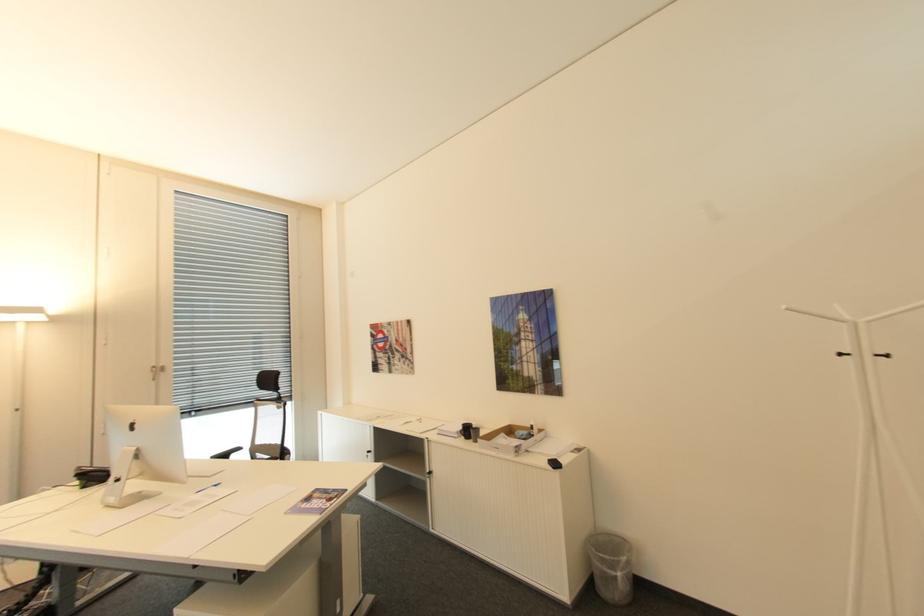
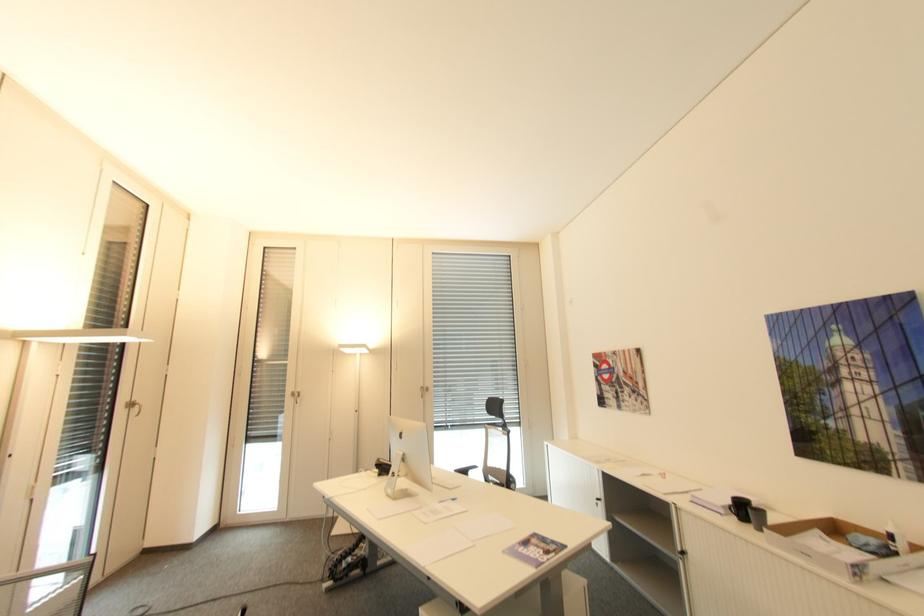
Find the pixel in the second image that matches (x=536, y=427) in the first image.

(895, 537)